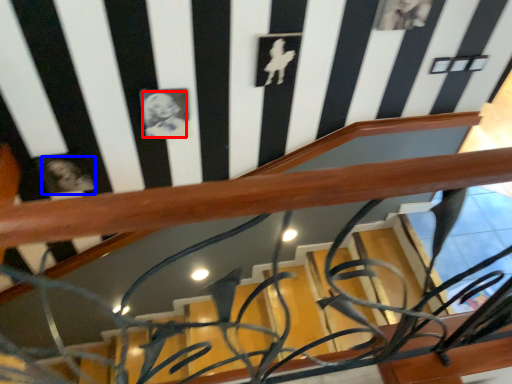
Question: Which point is further to the camera, art (highlighted by a red box) or art (highlighted by a blue box)?

Choices:
 (A) art
 (B) art

Answer: (B)